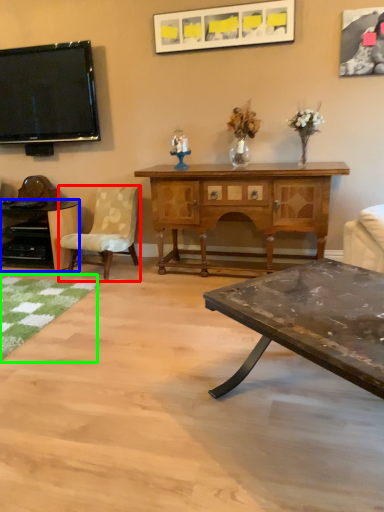
Question: Estimate the real-world distances between objects in this image. Which object is farther from chair (highlighted by a red box), desk (highlighted by a blue box) or mat (highlighted by a green box)?

Choices:
 (A) desk
 (B) mat

Answer: (B)